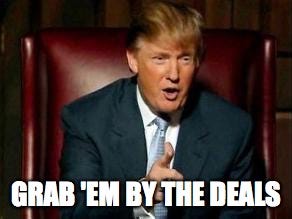
Where is `red leather chair`? This screenshot has height=219, width=292. red leather chair is located at coordinates (71, 73), (44, 112), (220, 62), (244, 83).